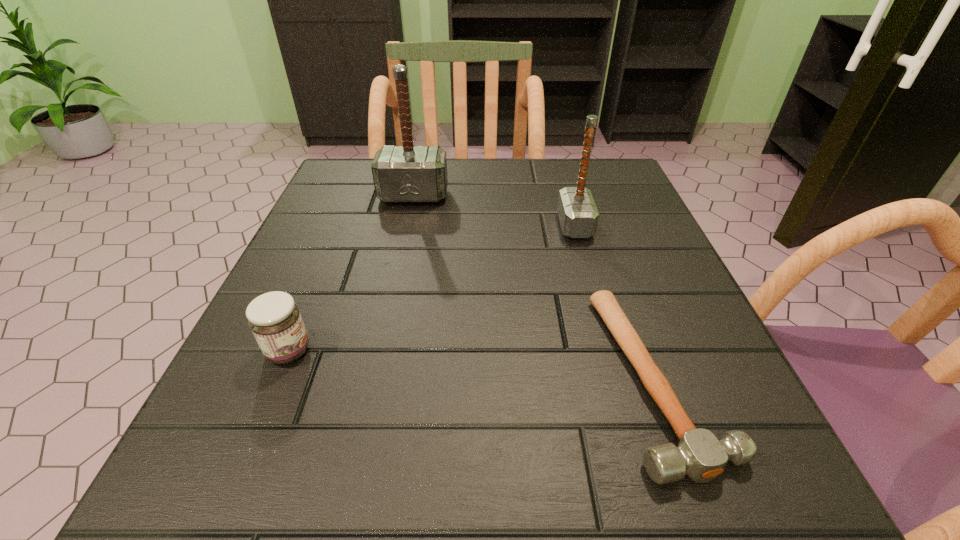
This screenshot has width=960, height=540. In order to click on free space located on the striking surface of the second nearest hammer in this screenshot , I will do `click(431, 226)`.

Locate an element on the screen. vacant space located 0.090m on the striking surface of the second nearest hammer is located at coordinates (515, 226).

The image size is (960, 540). Find the location of `vacant region located on the front label of the leftmost object`. vacant region located on the front label of the leftmost object is located at coordinates (352, 351).

At what (x,y) coordinates should I click in order to perform the action: click on vacant space located 0.100m on the back of the shortest hammer. Please return your answer as a coordinate pair (x, y). Looking at the image, I should click on (616, 262).

The width and height of the screenshot is (960, 540). I want to click on object that is at the far edge, so click(x=405, y=174).

Image resolution: width=960 pixels, height=540 pixels. Find the location of `object positioned at the near edge`. object positioned at the near edge is located at coordinates (699, 454).

Where is `hammer that is at the left edge`? This screenshot has height=540, width=960. hammer that is at the left edge is located at coordinates (405, 174).

Find the location of a particular element. The width and height of the screenshot is (960, 540). jam situated at the left edge is located at coordinates (274, 318).

The height and width of the screenshot is (540, 960). In order to click on object that is at the far left corner in this screenshot , I will do `click(405, 174)`.

The height and width of the screenshot is (540, 960). I want to click on object situated at the near right corner, so click(x=699, y=454).